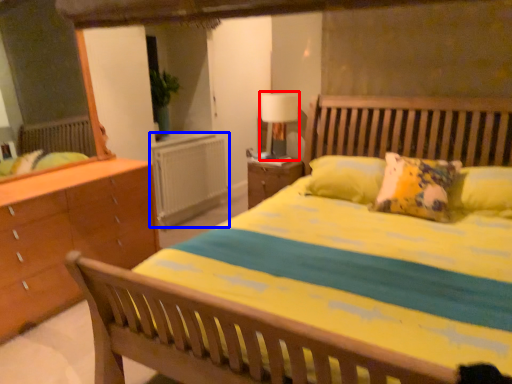
Question: Which of the following is the farthest to the observer, table lamp (highlighted by a red box) or radiator (highlighted by a blue box)?

Choices:
 (A) table lamp
 (B) radiator

Answer: (B)